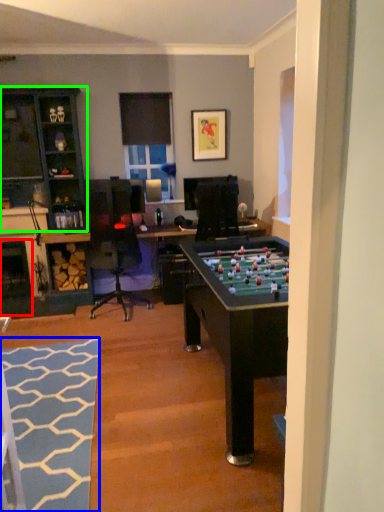
Question: Which object is positioned closest to fireplace (highlighted by a red box)? Select from flat (highlighted by a blue box) and cabinetry (highlighted by a green box).

Choices:
 (A) flat
 (B) cabinetry

Answer: (B)